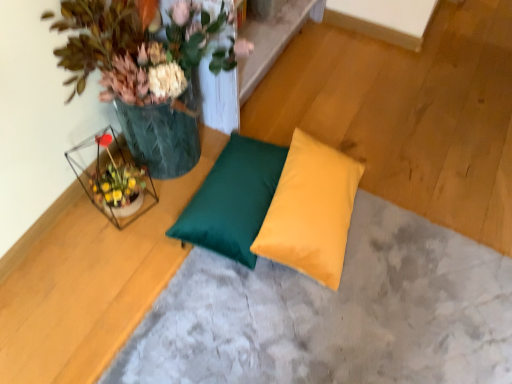
Question: Considering the relative positions of green leafy plant at upper left and yellow satin pillow at center, the first pillow viewed from the right, in the image provided, is green leafy plant at upper left behind yellow satin pillow at center, the first pillow viewed from the right,?

Choices:
 (A) no
 (B) yes

Answer: (A)

Question: Considering the relative sizes of green leafy plant at upper left and yellow satin pillow at center, the first pillow viewed from the right, in the image provided, is green leafy plant at upper left shorter than yellow satin pillow at center, the first pillow viewed from the right,?

Choices:
 (A) yes
 (B) no

Answer: (B)

Question: Can you confirm if green leafy plant at upper left is bigger than yellow satin pillow at center, the first pillow viewed from the right?

Choices:
 (A) no
 (B) yes

Answer: (B)

Question: Is green leafy plant at upper left oriented away from yellow satin pillow at center, the first pillow viewed from the right?

Choices:
 (A) no
 (B) yes

Answer: (A)

Question: From the image's perspective, would you say green leafy plant at upper left is shown under yellow satin pillow at center, the first pillow viewed from the right?

Choices:
 (A) yes
 (B) no

Answer: (B)

Question: Based on their positions, is matte green pillow at center located to the left or right of satin green pillow at center, which is the 1th pillow in left-to-right order?

Choices:
 (A) left
 (B) right

Answer: (B)

Question: From the image's perspective, is matte green pillow at center positioned above or below satin green pillow at center, which is the 1th pillow in left-to-right order?

Choices:
 (A) below
 (B) above

Answer: (A)

Question: From their relative heights in the image, would you say matte green pillow at center is taller or shorter than satin green pillow at center, the 2th pillow viewed from the right?

Choices:
 (A) tall
 (B) short

Answer: (B)

Question: Is matte green pillow at center inside or outside of satin green pillow at center, which is the 1th pillow in left-to-right order?

Choices:
 (A) inside
 (B) outside

Answer: (B)

Question: From the image's perspective, relative to matte green pillow at center, is satin green pillow at center, the 2th pillow viewed from the right, above or below?

Choices:
 (A) below
 (B) above

Answer: (B)

Question: Is satin green pillow at center, the 2th pillow viewed from the right, bigger or smaller than matte green pillow at center?

Choices:
 (A) big
 (B) small

Answer: (B)

Question: From a real-world perspective, is satin green pillow at center, the 2th pillow viewed from the right, positioned above or below matte green pillow at center?

Choices:
 (A) below
 (B) above

Answer: (B)

Question: Is satin green pillow at center, which is the 1th pillow in left-to-right order, wider or thinner than matte green pillow at center?

Choices:
 (A) thin
 (B) wide

Answer: (A)

Question: In terms of width, does yellow satin pillow at center, the first pillow viewed from the right, look wider or thinner when compared to matte green pillow at center?

Choices:
 (A) wide
 (B) thin

Answer: (B)

Question: Is point (352, 180) closer or farther from the camera than point (271, 352)?

Choices:
 (A) closer
 (B) farther

Answer: (B)